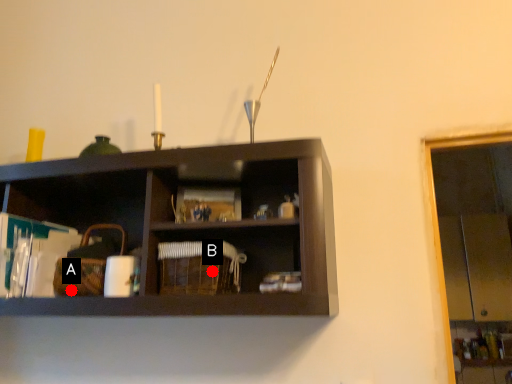
Question: Two points are circled on the image, labeled by A and B beside each circle. Which point is further to the camera?

Choices:
 (A) A is further
 (B) B is further

Answer: (A)